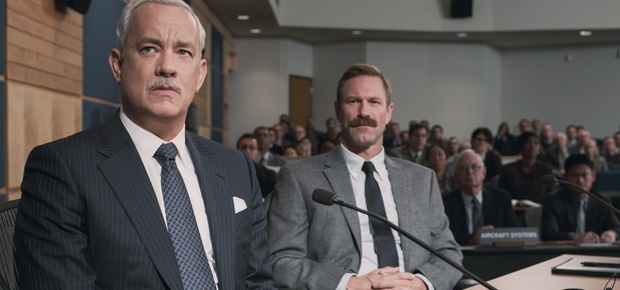
You are a GUI agent. You are given a task and a screenshot of the screen. Output one action in this format:
    pyautogui.click(x=<x>, y=<y>)
    Task: Click on the table
    This screenshot has height=290, width=620.
    Given the screenshot: What is the action you would take?
    pyautogui.click(x=541, y=271)